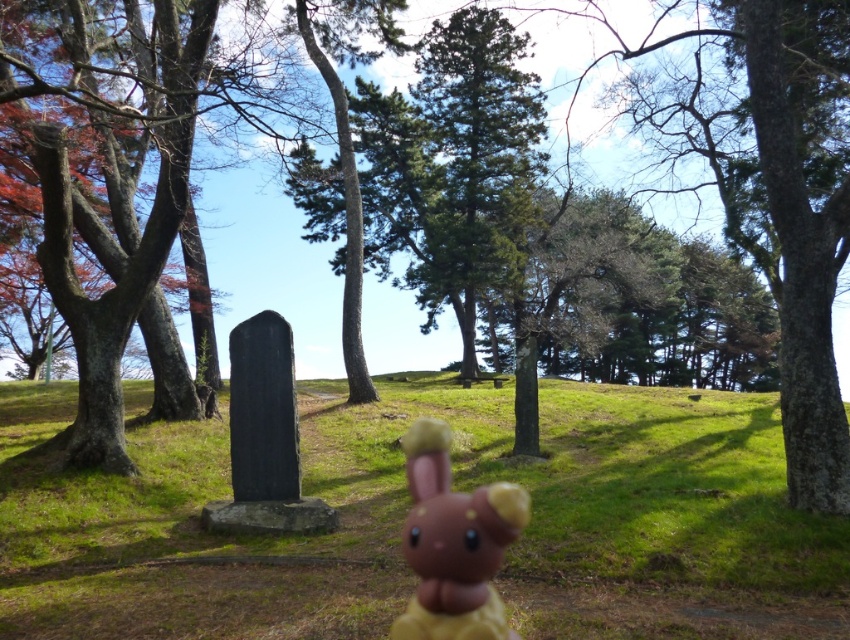
Question: Which point is farther to the camera?

Choices:
 (A) (493, 477)
 (B) (421, 496)

Answer: (A)

Question: Can you confirm if green grassy at center is smaller than brown matte plush toy at center?

Choices:
 (A) no
 (B) yes

Answer: (A)

Question: Can you confirm if green grassy at center is smaller than brown matte plush toy at center?

Choices:
 (A) yes
 (B) no

Answer: (B)

Question: Among these points, which one is farthest from the camera?

Choices:
 (A) (x=442, y=474)
 (B) (x=786, y=541)

Answer: (B)

Question: Does green grassy at center have a smaller size compared to brown matte plush toy at center?

Choices:
 (A) no
 (B) yes

Answer: (A)